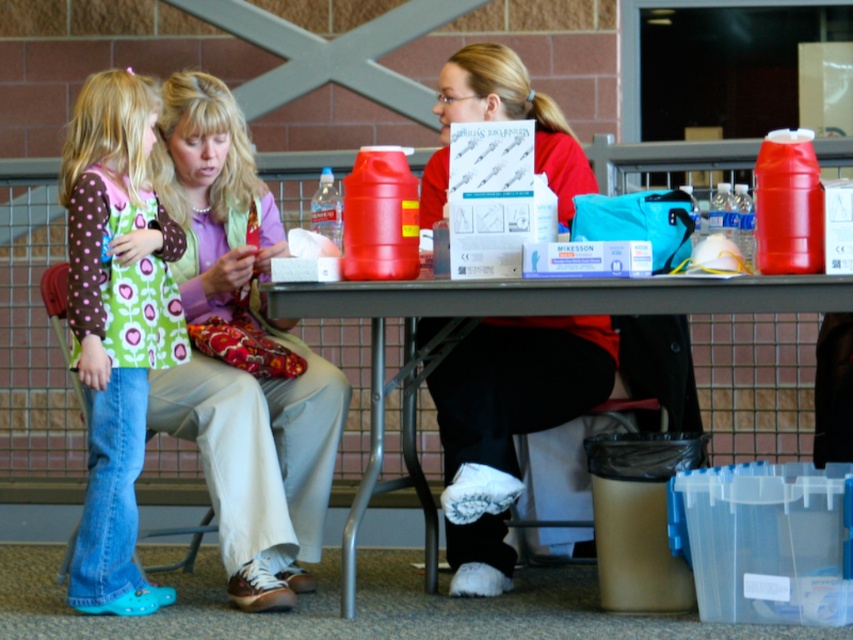
Question: Which point is closer to the camera?

Choices:
 (A) (149, 225)
 (B) (440, 310)

Answer: (B)

Question: Which object is the closest to the polka dot fabric dress at lower left?

Choices:
 (A) matte purple sweater at center
 (B) matte red shirt at center
 (C) metallic gray table at center

Answer: (A)

Question: Can you confirm if matte purple sweater at center is bigger than metallic gray table at center?

Choices:
 (A) yes
 (B) no

Answer: (B)

Question: Which object is positioned farthest from the matte purple sweater at center?

Choices:
 (A) matte red shirt at center
 (B) metallic gray table at center
 (C) polka dot fabric dress at lower left

Answer: (A)

Question: Can you confirm if matte red shirt at center is wider than metallic gray table at center?

Choices:
 (A) no
 (B) yes

Answer: (A)

Question: In this image, where is matte purple sweater at center located relative to metallic gray table at center?

Choices:
 (A) below
 (B) above

Answer: (B)